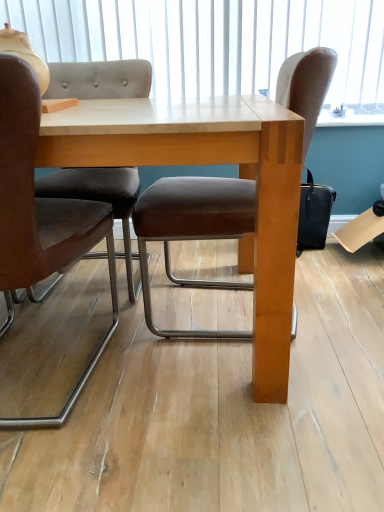
Where is `light wood table at center`? The width and height of the screenshot is (384, 512). light wood table at center is located at coordinates (209, 164).

What is the approximate height of brown leather chair at left, positioned as the second chair in right-to-left order?

brown leather chair at left, positioned as the second chair in right-to-left order, is 93.43 centimeters in height.

Where is `light wood table at center`? This screenshot has width=384, height=512. light wood table at center is located at coordinates (209, 164).

Which object is further away from the camera taking this photo, brown leather chair at left, positioned as the second chair in right-to-left order, or brown leather chair at center, which is the 1th chair in right-to-left order?

brown leather chair at center, which is the 1th chair in right-to-left order.

The height and width of the screenshot is (512, 384). Find the location of `chair below the brown leather chair at center, which is the 2th chair in left-to-right order (from a real-world perspective)`. chair below the brown leather chair at center, which is the 2th chair in left-to-right order (from a real-world perspective) is located at coordinates 40,215.

Which point is more forward, (25, 131) or (173, 183)?

Point (25, 131)

From the picture: Is brown leather chair at left, arranged as the first chair when viewed from the left, positioned with its back to brown leather chair at center, which is the 2th chair in left-to-right order?

No.

Is light wood table at center at the back of brown leather chair at center, which is the 1th chair in right-to-left order?

Yes.

Consider the image. What's the angular difference between brown leather chair at center, which is the 2th chair in left-to-right order, and light wood table at center's facing directions?

brown leather chair at center, which is the 2th chair in left-to-right order, and light wood table at center are facing 92.2 degrees away from each other.

Is point (324, 51) in front of point (169, 102)?

Yes.

Consider the image. Which object is positioned more to the right, brown leather chair at center, which is the 1th chair in right-to-left order, or light wood table at center?

From the viewer's perspective, brown leather chair at center, which is the 1th chair in right-to-left order, appears more on the right side.

From the image's perspective, relative to light wood table at center, is white matte window screen at upper center above or below?

From the image's perspective, white matte window screen at upper center appears above light wood table at center.

Is point (227, 20) closer or farther from the camera than point (269, 362)?

Point (227, 20) is farther from the camera than point (269, 362).

Is white matte window screen at upper center positioned far away from light wood table at center?

Absolutely, white matte window screen at upper center is distant from light wood table at center.

Identify the location of window screen that appears above the light wood table at center (from the image's perspective). The width and height of the screenshot is (384, 512). (217, 42).

You are a GUI agent. You are given a task and a screenshot of the screen. Output one action in this format:
    pyautogui.click(x=<x>, y=<y>)
    Task: Click on the table behind the brown leather chair at left, positioned as the second chair in right-to-left order
    This screenshot has width=384, height=512.
    Given the screenshot: What is the action you would take?
    pyautogui.click(x=209, y=164)

Is light wood table at center thinner than brown leather chair at left, arranged as the first chair when viewed from the left?

Incorrect, the width of light wood table at center is not less than that of brown leather chair at left, arranged as the first chair when viewed from the left.

Is light wood table at center further to the viewer compared to brown leather chair at left, positioned as the second chair in right-to-left order?

Answer: Yes, it is behind brown leather chair at left, positioned as the second chair in right-to-left order.

Is light wood table at center far from brown leather chair at left, positioned as the second chair in right-to-left order?

light wood table at center is near brown leather chair at left, positioned as the second chair in right-to-left order, not far away.

Does white matte window screen at upper center touch brown leather chair at center, which is the 1th chair in right-to-left order?

There is a gap between white matte window screen at upper center and brown leather chair at center, which is the 1th chair in right-to-left order.

Considering the positions of objects white matte window screen at upper center and brown leather chair at center, which is the 2th chair in left-to-right order, in the image provided, who is in front, white matte window screen at upper center or brown leather chair at center, which is the 2th chair in left-to-right order,?

brown leather chair at center, which is the 2th chair in left-to-right order, is closer to the camera.

Which of these two, white matte window screen at upper center or brown leather chair at center, which is the 2th chair in left-to-right order, stands shorter?

white matte window screen at upper center.

Is point (201, 34) closer to camera compared to point (291, 59)?

No, it is behind (291, 59).

Where is `table on the left of white matte window screen at upper center`? Image resolution: width=384 pixels, height=512 pixels. table on the left of white matte window screen at upper center is located at coordinates [209, 164].

Based on their sizes in the image, would you say light wood table at center is bigger or smaller than white matte window screen at upper center?

Considering their sizes, light wood table at center takes up more space than white matte window screen at upper center.

Considering their positions, is light wood table at center located in front of or behind white matte window screen at upper center?

Visually, light wood table at center is located in front of white matte window screen at upper center.

Considering the positions of point (270, 373) and point (85, 13), is point (270, 373) closer or farther from the camera than point (85, 13)?

Clearly, point (270, 373) is closer to the camera than point (85, 13).

Which of these two, brown leather chair at center, which is the 2th chair in left-to-right order, or brown leather chair at left, arranged as the first chair when viewed from the left, is bigger?

With larger size is brown leather chair at center, which is the 2th chair in left-to-right order.

Is brown leather chair at center, which is the 2th chair in left-to-right order, inside the boundaries of brown leather chair at left, arranged as the first chair when viewed from the left, or outside?

brown leather chair at center, which is the 2th chair in left-to-right order, is not enclosed by brown leather chair at left, arranged as the first chair when viewed from the left.

How different are the orientations of brown leather chair at center, which is the 1th chair in right-to-left order, and brown leather chair at left, positioned as the second chair in right-to-left order, in degrees?

There is a 90-degree angle between the facing directions of brown leather chair at center, which is the 1th chair in right-to-left order, and brown leather chair at left, positioned as the second chair in right-to-left order.

Considering the relative sizes of brown leather chair at center, which is the 1th chair in right-to-left order, and brown leather chair at left, positioned as the second chair in right-to-left order, in the image provided, is brown leather chair at center, which is the 1th chair in right-to-left order, shorter than brown leather chair at left, positioned as the second chair in right-to-left order,?

Yes.

In the image, there is a brown leather chair at center, which is the 2th chair in left-to-right order. Where is `chair below it (from a real-world perspective)`? chair below it (from a real-world perspective) is located at coordinates (40, 215).

From a real-world perspective, which chair is the 2nd one above the light wood table at center? Please provide its 2D coordinates.

[(193, 231)]

Considering their positions, is light wood table at center positioned further to brown leather chair at left, positioned as the second chair in right-to-left order, than brown leather chair at center, which is the 2th chair in left-to-right order?

The object further to brown leather chair at left, positioned as the second chair in right-to-left order, is brown leather chair at center, which is the 2th chair in left-to-right order.

Looking at the image, which one is located further to light wood table at center, brown leather chair at left, arranged as the first chair when viewed from the left, or brown leather chair at center, which is the 1th chair in right-to-left order?

brown leather chair at left, arranged as the first chair when viewed from the left.

Which object lies nearer to the anchor point brown leather chair at center, which is the 2th chair in left-to-right order, light wood table at center or brown leather chair at left, positioned as the second chair in right-to-left order?

light wood table at center lies closer to brown leather chair at center, which is the 2th chair in left-to-right order, than the other object.

Considering their positions, is white matte window screen at upper center positioned closer to brown leather chair at left, positioned as the second chair in right-to-left order, than light wood table at center?

The object closer to brown leather chair at left, positioned as the second chair in right-to-left order, is light wood table at center.

Estimate the real-world distances between objects in this image. Which object is closer to light wood table at center, brown leather chair at left, positioned as the second chair in right-to-left order, or white matte window screen at upper center?

The object closer to light wood table at center is brown leather chair at left, positioned as the second chair in right-to-left order.

Considering their positions, is brown leather chair at center, which is the 2th chair in left-to-right order, positioned closer to brown leather chair at left, positioned as the second chair in right-to-left order, than white matte window screen at upper center?

brown leather chair at center, which is the 2th chair in left-to-right order, is closer to brown leather chair at left, positioned as the second chair in right-to-left order.

Consider the image. When comparing their distances from brown leather chair at center, which is the 2th chair in left-to-right order, does brown leather chair at left, positioned as the second chair in right-to-left order, or light wood table at center seem closer?

light wood table at center is positioned closer to the anchor brown leather chair at center, which is the 2th chair in left-to-right order.

Based on their spatial positions, is brown leather chair at center, which is the 2th chair in left-to-right order, or light wood table at center closer to white matte window screen at upper center?

Based on the image, brown leather chair at center, which is the 2th chair in left-to-right order, appears to be nearer to white matte window screen at upper center.

The height and width of the screenshot is (512, 384). I want to click on table between brown leather chair at left, positioned as the second chair in right-to-left order, and white matte window screen at upper center from front to back, so click(x=209, y=164).

Identify the location of chair located between light wood table at center and white matte window screen at upper center in the depth direction. (193, 231).

This screenshot has height=512, width=384. What are the coordinates of `chair located between brown leather chair at left, arranged as the first chair when viewed from the left, and white matte window screen at upper center in the depth direction` in the screenshot? It's located at (193, 231).

Find the location of a particular element. The width and height of the screenshot is (384, 512). table between brown leather chair at left, positioned as the second chair in right-to-left order, and brown leather chair at center, which is the 2th chair in left-to-right order is located at coordinates pyautogui.click(x=209, y=164).